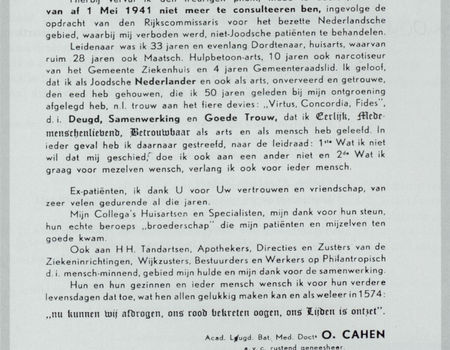
Identify the location of 1 white piece of paper. (419, 245).